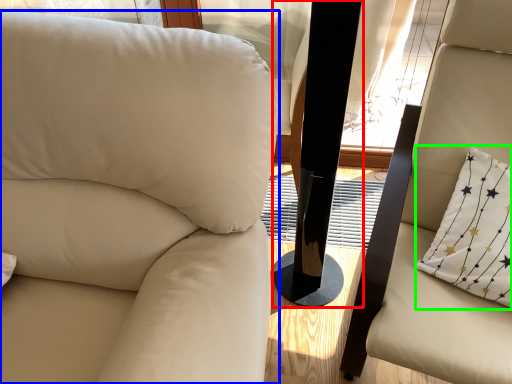
Question: Which is farther away from pillar (highlighted by a red box)? chair (highlighted by a blue box) or pillow (highlighted by a green box)?

Choices:
 (A) chair
 (B) pillow

Answer: (A)